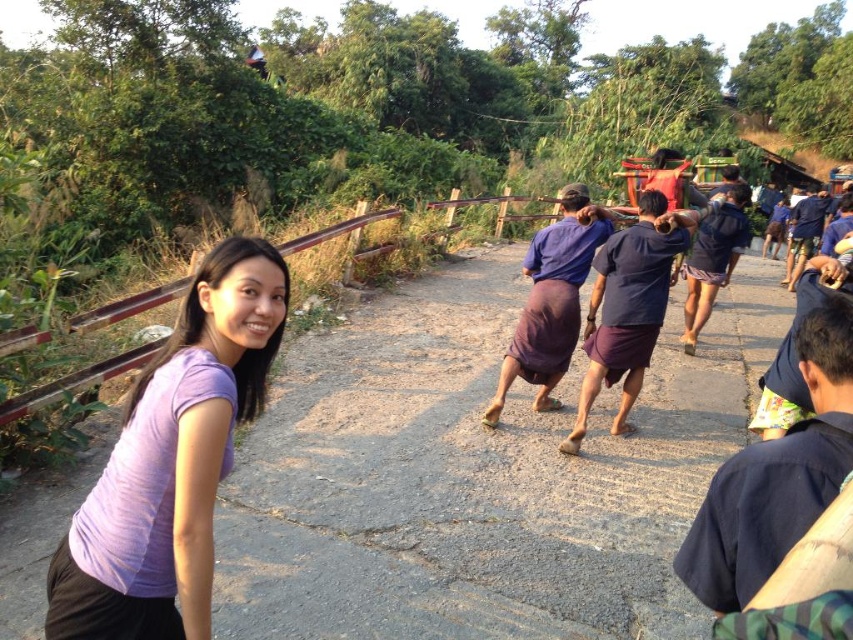
You are a photographer taking a picture of a woman wearing a purple cotton shirt at center and a purple cotton skirt at center. Which piece of clothing is closer to the camera?

The purple cotton shirt at center is closer to the camera because it is in front of the purple cotton skirt at center.

You are a photographer trying to capture the best shot of the woman in the scene. You notice two points marked in the image. Which point is closer to the camera, point [657,330] or point [529,301]?

Point [657,330] is in front of point [529,301], so it is closer to the camera.

You are a photographer trying to capture the purple matte shirt at lower left in the scene. Where exactly should you focus your camera to ensure it is centered in the frame?

You should focus your camera at point (172, 461) to center the purple matte shirt at lower left in the frame.